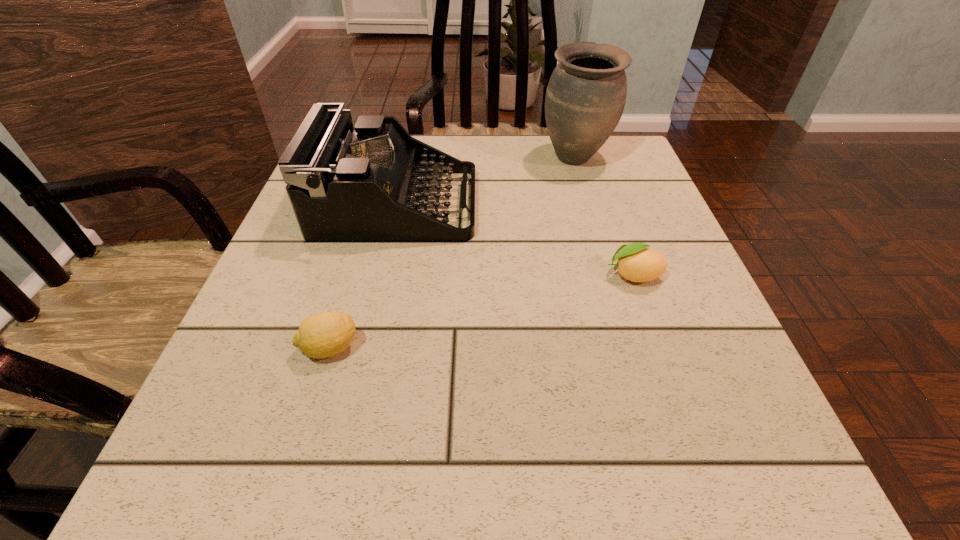
The width and height of the screenshot is (960, 540). Identify the location of vacant space that's between the right lemon and the nearest object. (482, 312).

This screenshot has width=960, height=540. What are the coordinates of `vacant region between the second tallest object and the nearer lemon` in the screenshot? It's located at (363, 276).

In order to click on free space between the left lemon and the third shortest object in this screenshot , I will do pos(363,276).

Where is `vacant space that's between the typewriter and the tallest object`? This screenshot has width=960, height=540. vacant space that's between the typewriter and the tallest object is located at coordinates (486, 181).

The image size is (960, 540). Find the location of `vacant point located between the typewriter and the third farthest object`. vacant point located between the typewriter and the third farthest object is located at coordinates (515, 240).

Locate an element on the screen. object that is the third nearest to the farther lemon is located at coordinates (323, 335).

Point out which object is positioned as the nearest to the right lemon. Please provide its 2D coordinates. Your answer should be formatted as a tuple, i.e. [(x, y)], where the tuple contains the x and y coordinates of a point satisfying the conditions above.

[(366, 184)]

You are a GUI agent. You are given a task and a screenshot of the screen. Output one action in this format:
    pyautogui.click(x=<x>, y=<y>)
    Task: Click on the vacant space that satisfies the following two spatial constraints: 1. on the front side of the urn; 2. on the typing side of the second tallest object
    
    Given the screenshot: What is the action you would take?
    pyautogui.click(x=588, y=205)